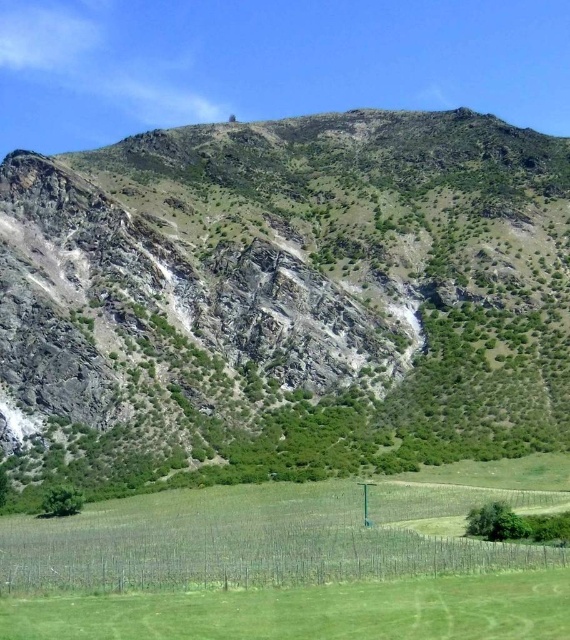
Question: Does green rocky mountain at upper center come in front of green grassy field at lower center?

Choices:
 (A) no
 (B) yes

Answer: (A)

Question: Does green rocky mountain at upper center have a larger size compared to green grassy field at lower center?

Choices:
 (A) yes
 (B) no

Answer: (A)

Question: Which of the following is the closest to the observer?

Choices:
 (A) green rocky mountain at upper center
 (B) green grassy field at lower center

Answer: (B)

Question: Among these points, which one is nearest to the camera?

Choices:
 (A) click(x=523, y=490)
 (B) click(x=372, y=292)

Answer: (A)

Question: Among these objects, which one is farthest from the camera?

Choices:
 (A) green rocky mountain at upper center
 (B) green grassy field at lower center

Answer: (A)

Question: Is green rocky mountain at upper center below green grassy field at lower center?

Choices:
 (A) yes
 (B) no

Answer: (B)